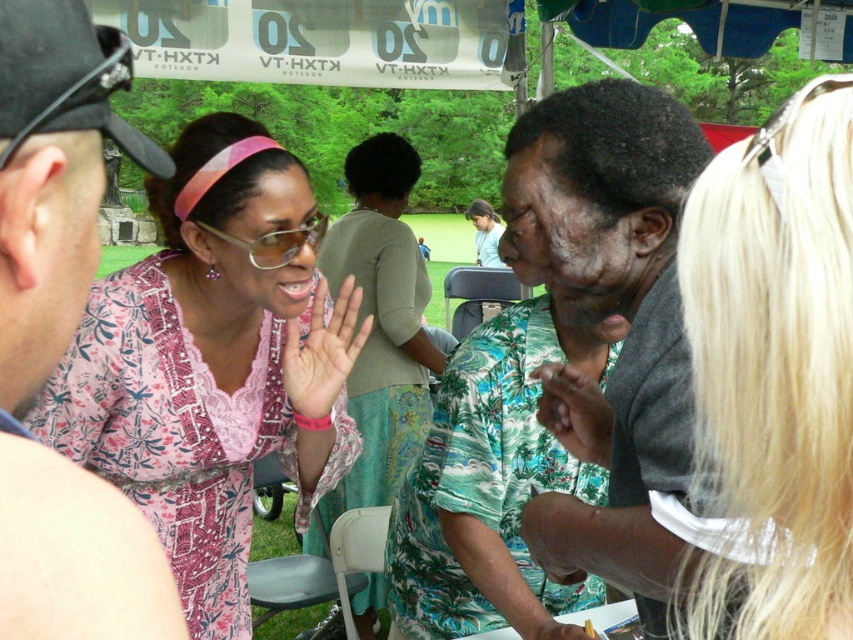
You are a photographer trying to capture a group photo of the blonde hair at upper right and the pink lace dress at center. If you want to ensure both subjects are in focus, which one should you adjust your camera focus on first?

Since the blonde hair at upper right is narrower than the pink lace dress at center, you should focus on the pink lace dress at center first as it has a larger surface area, making it easier to capture clearly.

You are standing in the park and see the banner above the people. The banner is at the top of the image. There is a point marked at coordinates (213, 362). What object is located at that point?

The point at coordinates (213, 362) marks the pink floral dress at center.

You are standing at the point labeled point (750, 284) and want to move to the point labeled point (379, 374). Which direction should you move to get there?

You should move downward and to the right to reach point (379, 374) from point (750, 284).